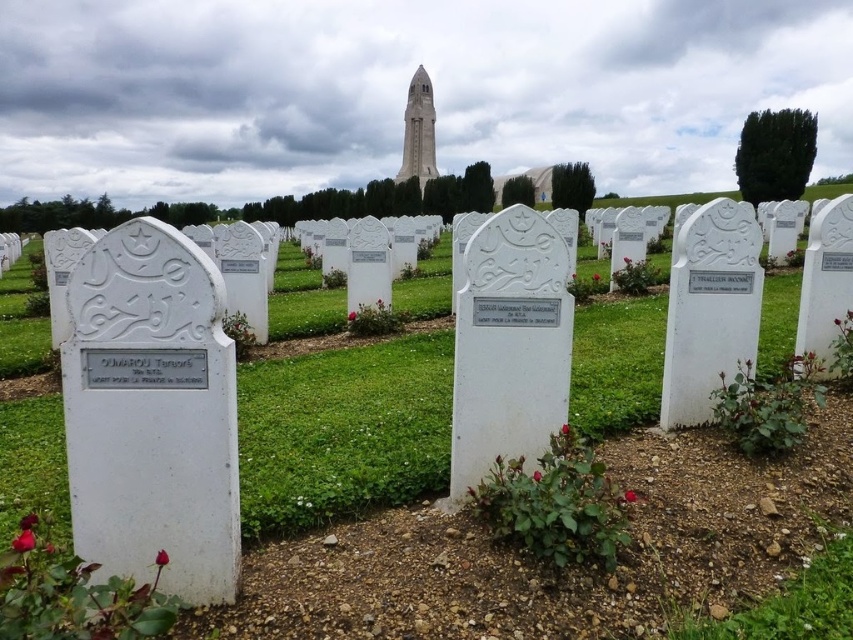
Does white marble tombstones at center appear over white marble tower at center?

Actually, white marble tombstones at center is below white marble tower at center.

Identify the location of white marble tombstones at center. (541, 572).

At what (x,y) coordinates should I click in order to perform the action: click on white marble tombstones at center. Please return your answer as a coordinate pair (x, y). This screenshot has height=640, width=853. Looking at the image, I should click on (541, 572).